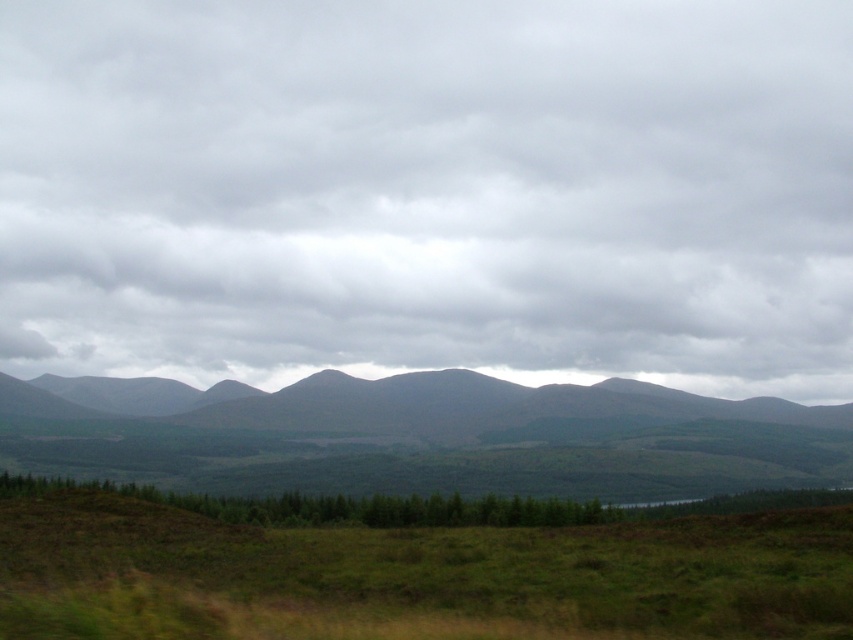
Can you confirm if green grassy field at lower center is smaller than gray textured mountains at center?

Indeed, green grassy field at lower center has a smaller size compared to gray textured mountains at center.

Between green grassy field at lower center and gray textured mountains at center, which one appears on the right side from the viewer's perspective?

green grassy field at lower center is more to the right.

This screenshot has height=640, width=853. Describe the element at coordinates (416, 576) in the screenshot. I see `green grassy field at lower center` at that location.

The height and width of the screenshot is (640, 853). I want to click on green grassy field at lower center, so click(416, 576).

Can you confirm if cloudy gray sky at upper center is taller than gray textured mountains at center?

Correct, cloudy gray sky at upper center is much taller as gray textured mountains at center.

Image resolution: width=853 pixels, height=640 pixels. What do you see at coordinates (428, 192) in the screenshot?
I see `cloudy gray sky at upper center` at bounding box center [428, 192].

The width and height of the screenshot is (853, 640). Find the location of `cloudy gray sky at upper center`. cloudy gray sky at upper center is located at coordinates (428, 192).

Which is above, cloudy gray sky at upper center or green grassy field at lower center?

cloudy gray sky at upper center is above.

Image resolution: width=853 pixels, height=640 pixels. I want to click on cloudy gray sky at upper center, so click(428, 192).

Where is `cloudy gray sky at upper center`? The image size is (853, 640). cloudy gray sky at upper center is located at coordinates (428, 192).